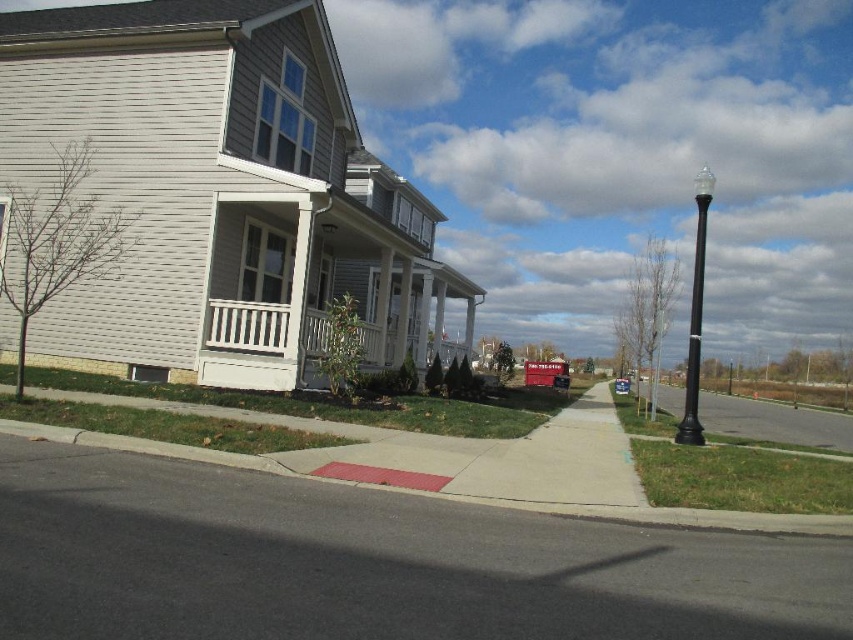
Question: Which point is closer to the camera?

Choices:
 (A) (695, 280)
 (B) (260, 305)
 (C) (704, 621)

Answer: (C)

Question: Is white painted wood porch at center positioned in front of metallic silver sedan at center?

Choices:
 (A) no
 (B) yes

Answer: (B)

Question: Can you confirm if white painted wood porch at center is wider than metallic silver sedan at center?

Choices:
 (A) no
 (B) yes

Answer: (A)

Question: Does black asphalt at lower left have a lesser width compared to metallic silver sedan at center?

Choices:
 (A) no
 (B) yes

Answer: (B)

Question: Which is farther from the black polished metal streetlight at right?

Choices:
 (A) black asphalt at lower left
 (B) white painted wood porch at center

Answer: (A)

Question: Which point appears closest to the camera in this image?

Choices:
 (A) (695, 296)
 (B) (370, 336)
 (C) (24, 611)
 (D) (614, 388)

Answer: (C)